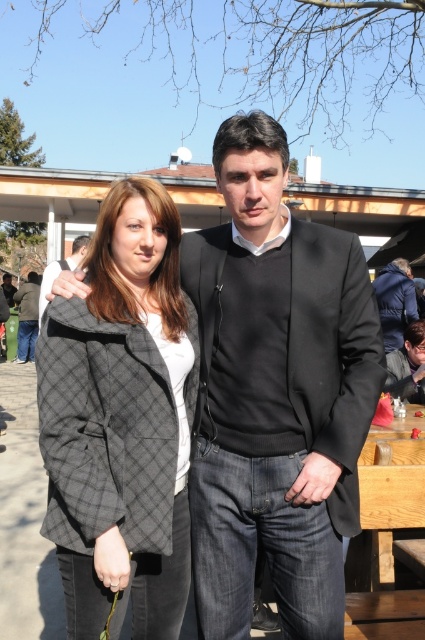
Measure the distance between dark blue jacket at right and camera.

The distance of dark blue jacket at right from camera is 7.25 meters.

Is dark blue jacket at right wider than dark gray suit at center?

In fact, dark blue jacket at right might be narrower than dark gray suit at center.

Is point (402, 284) positioned in front of point (30, 273)?

Yes, point (402, 284) is in front of point (30, 273).

You are a GUI agent. You are given a task and a screenshot of the screen. Output one action in this format:
    pyautogui.click(x=<x>, y=<y>)
    Task: Click on the dark blue jacket at right
    The height and width of the screenshot is (640, 425).
    Given the screenshot: What is the action you would take?
    pyautogui.click(x=394, y=301)

Can you confirm if black matte blazer at center is taller than plaid wool coat at center?

Yes.

Does black matte blazer at center appear over plaid wool coat at center?

Yes, black matte blazer at center is above plaid wool coat at center.

Between point (322, 538) and point (170, 221), which one is positioned in front?

Point (322, 538)

Where is `black matte blazer at center`? black matte blazer at center is located at coordinates [x=275, y=394].

Is black matte blazer at center taller than wooden picnic table at lower right?

Yes.

Is point (368, 321) positioned behind point (374, 531)?

No, it is in front of (374, 531).

You are a GUI agent. You are given a task and a screenshot of the screen. Output one action in this format:
    pyautogui.click(x=<x>, y=<y>)
    Task: Click on the black matte blazer at center
    The width and height of the screenshot is (425, 640).
    Given the screenshot: What is the action you would take?
    pyautogui.click(x=275, y=394)